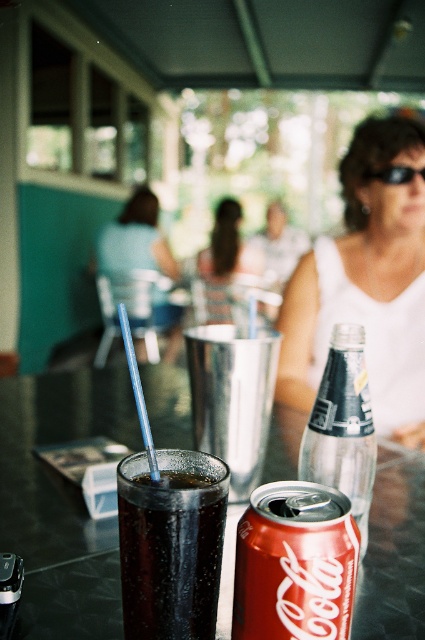
You are a waiter at the outdoor cafe. You need to place a new drink order on the table. The drink is taller than the glossy aluminum can at center. Will the drink fit on the glossy plastic table at center?

The glossy plastic table at center is positioned under the glossy aluminum can at center, so the drink may not fit if the table space is occupied by the can.

You are a delivery person who needs to place a small package between the clear glass bottle at center and the black plastic goggles at upper center. The package is 1 meter long. Can you fit it between them without moving either object?

The distance between the clear glass bottle at center and the black plastic goggles at upper center is 1.01 meters. Since the package is 1 meter long, it can fit between them as there is enough space.

You are trying to place a small coaster under the glossy aluminum can at center to protect the glossy plastic table at center from condensation. Based on the scene, will the coaster fit under the can?

The glossy plastic table at center is larger in size than glossy aluminum can at center, so the coaster should fit under the glossy aluminum can at center as the can is smaller than the table.